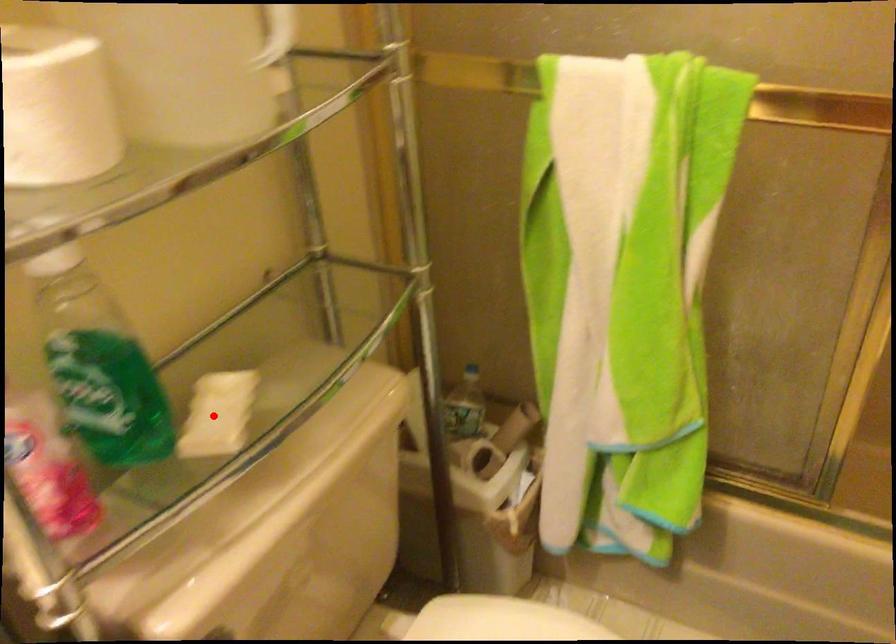
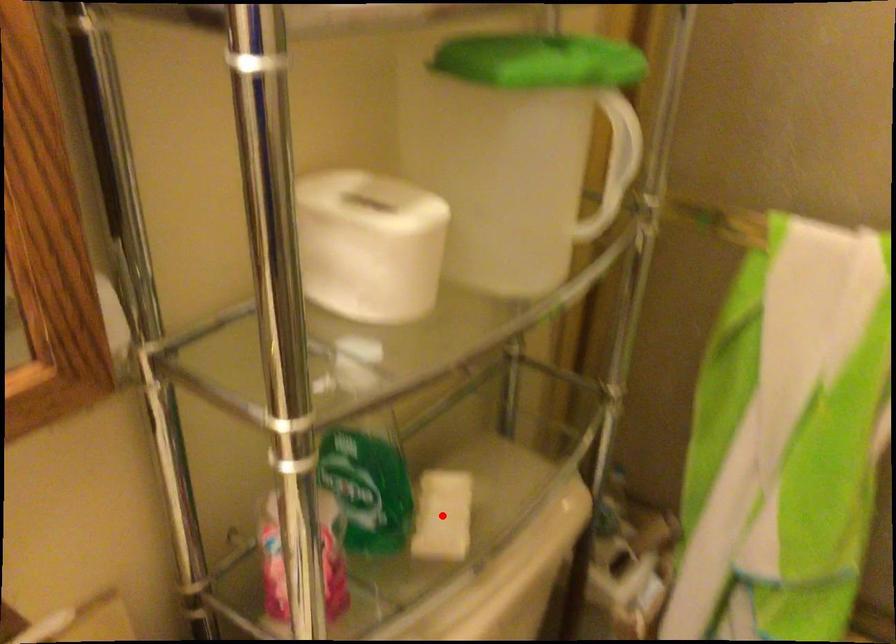
I am providing you with two images of the same scene from different viewpoints. A red point is marked on the first image and another point is marked on the second image. Do the highlighted points in image1 and image2 indicate the same real-world spot?

Yes